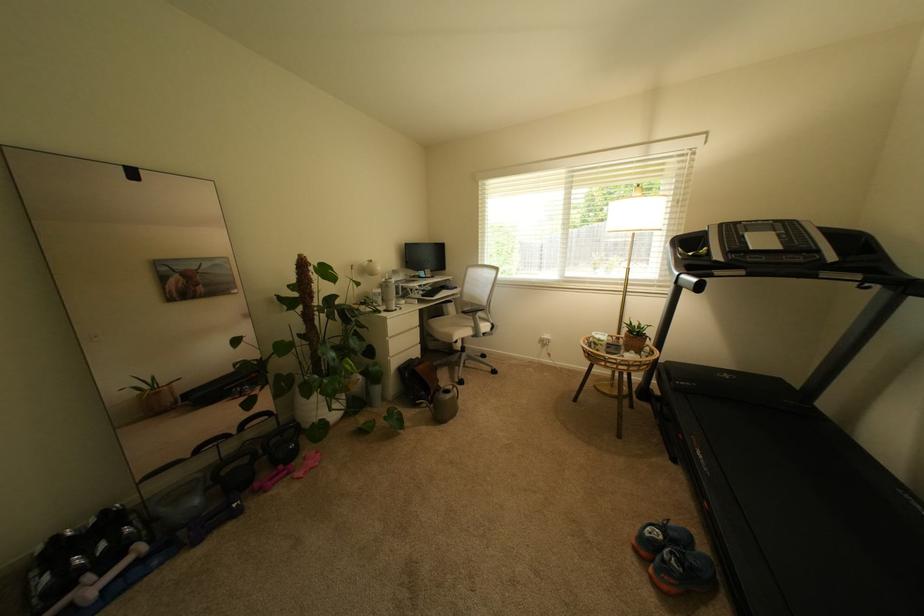
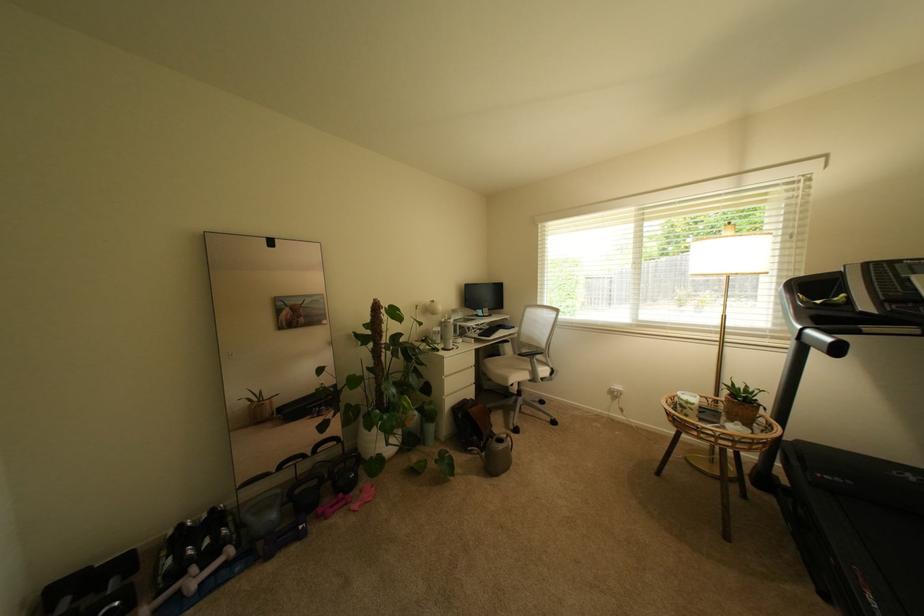
The point at (278, 480) is marked in the first image. Where is the corresponding point in the second image?

(339, 508)